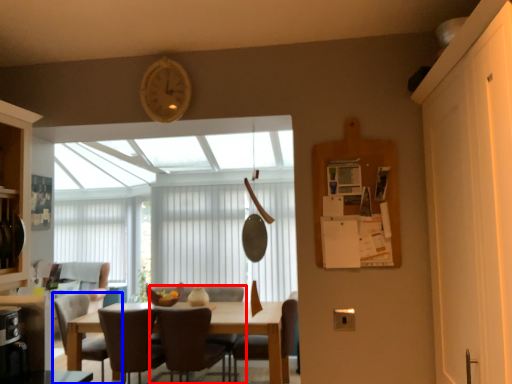
Question: Which point is closer to the camera, chair (highlighted by a red box) or chair (highlighted by a blue box)?

Choices:
 (A) chair
 (B) chair

Answer: (A)